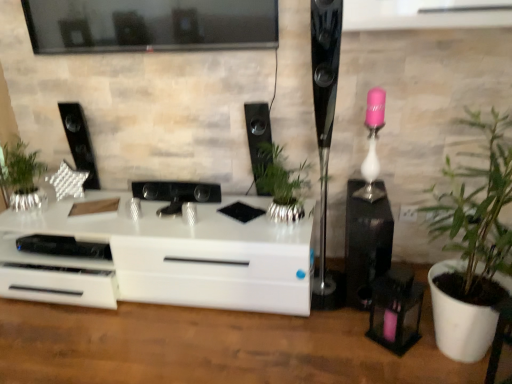
I want to click on free region under polished black speaker at right, acting as the second speaker starting from the right (from a real-world perspective), so click(325, 294).